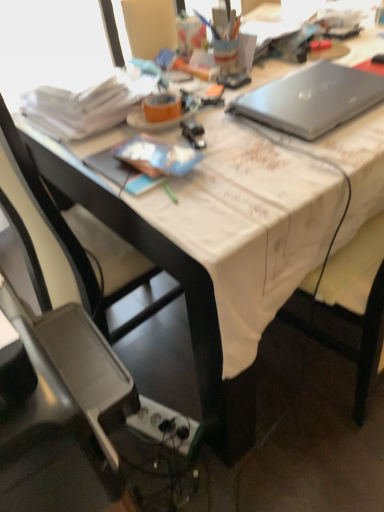
You are a GUI agent. You are given a task and a screenshot of the screen. Output one action in this format:
    pyautogui.click(x=<x>, y=<y>)
    Task: Click on the vacant area on the back side of metallic silver stapler at center
    This screenshot has width=384, height=512.
    Given the screenshot: What is the action you would take?
    pyautogui.click(x=211, y=113)